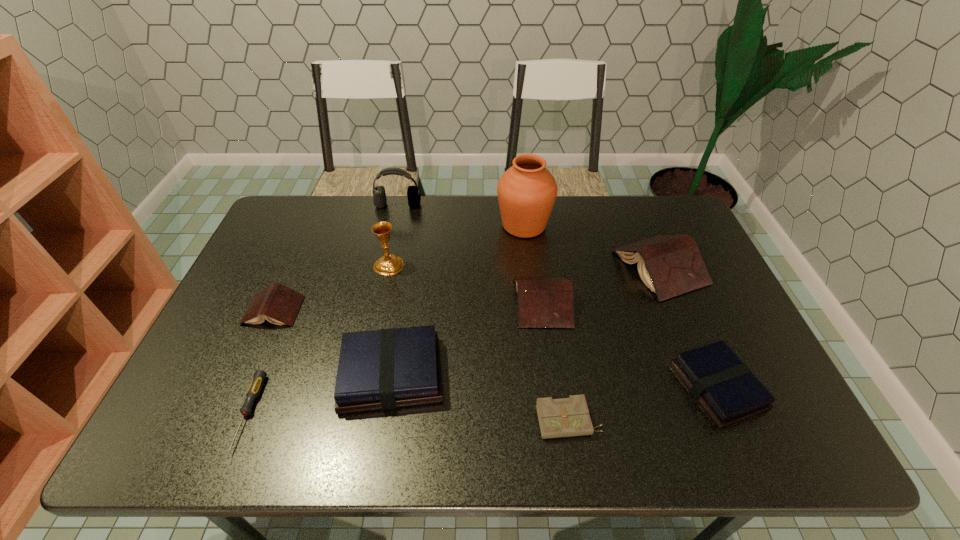
The height and width of the screenshot is (540, 960). What are the coordinates of `blank space at the far right corner of the desktop` in the screenshot? It's located at (659, 204).

Find the location of a particular element. empty location between the chalice and the shortest object is located at coordinates (319, 339).

Where is `free spot between the second brown book from right to left and the gold chalice`? This screenshot has width=960, height=540. free spot between the second brown book from right to left and the gold chalice is located at coordinates (466, 284).

Where is `empty space between the third book from right to left and the smaller blue book`? Image resolution: width=960 pixels, height=540 pixels. empty space between the third book from right to left and the smaller blue book is located at coordinates (630, 344).

The width and height of the screenshot is (960, 540). I want to click on free space between the ninth tallest object and the screwdriver, so click(409, 417).

At what (x,y) coordinates should I click in order to perform the action: click on free spot between the shortest object and the black headset. Please return your answer as a coordinate pair (x, y). This screenshot has width=960, height=540. Looking at the image, I should click on (324, 309).

This screenshot has width=960, height=540. What are the coordinates of `free area in between the screwdriver and the brown urn` in the screenshot? It's located at (386, 319).

Locate an element on the screen. This screenshot has height=540, width=960. vacant space in between the left blue book and the gold chalice is located at coordinates (390, 320).

You are a GUI agent. You are given a task and a screenshot of the screen. Output one action in this format:
    pyautogui.click(x=<x>, y=<y>)
    Task: Click on the blank region between the second book from left to right and the gold chalice
    The width and height of the screenshot is (960, 540).
    Given the screenshot: What is the action you would take?
    pyautogui.click(x=390, y=320)

Find the location of a particular element. The image size is (960, 540). free space between the tallest object and the smaller blue book is located at coordinates (621, 306).